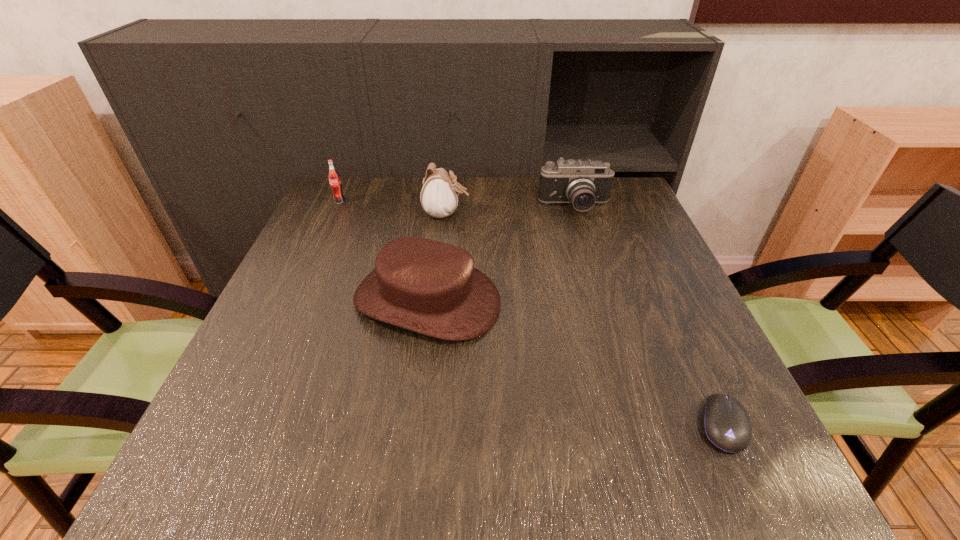
Find the location of a particular element. object that is at the near right corner is located at coordinates (726, 424).

Locate an element on the screen. This screenshot has width=960, height=540. free space at the far edge is located at coordinates (390, 215).

This screenshot has height=540, width=960. In the image, there is a desktop. What are the coordinates of `free space at the near edge` in the screenshot? It's located at (473, 497).

This screenshot has width=960, height=540. I want to click on vacant region at the left edge of the desktop, so click(x=247, y=422).

Find the location of a particular element. The image size is (960, 540). vacant region at the far left corner of the desktop is located at coordinates (348, 183).

The height and width of the screenshot is (540, 960). I want to click on free point at the near left corner, so click(x=227, y=476).

You are a GUI agent. You are given a task and a screenshot of the screen. Output one action in this format:
    pyautogui.click(x=<x>, y=<y>)
    Task: Click on the vacant region at the far right corner of the desktop
    The width and height of the screenshot is (960, 540).
    Given the screenshot: What is the action you would take?
    pyautogui.click(x=622, y=182)

At what (x,y) coordinates should I click in order to perform the action: click on unoccupied area between the nearest object and the leftmost object. Please return your answer as a coordinate pair (x, y). Looking at the image, I should click on (531, 313).

At what (x,y) coordinates should I click in order to perform the action: click on vacant space that's between the pouch and the camera. Please return your answer as a coordinate pair (x, y). This screenshot has width=960, height=540. Looking at the image, I should click on (511, 211).

Locate an element on the screen. This screenshot has width=960, height=540. free area in between the hat and the camera is located at coordinates (501, 254).